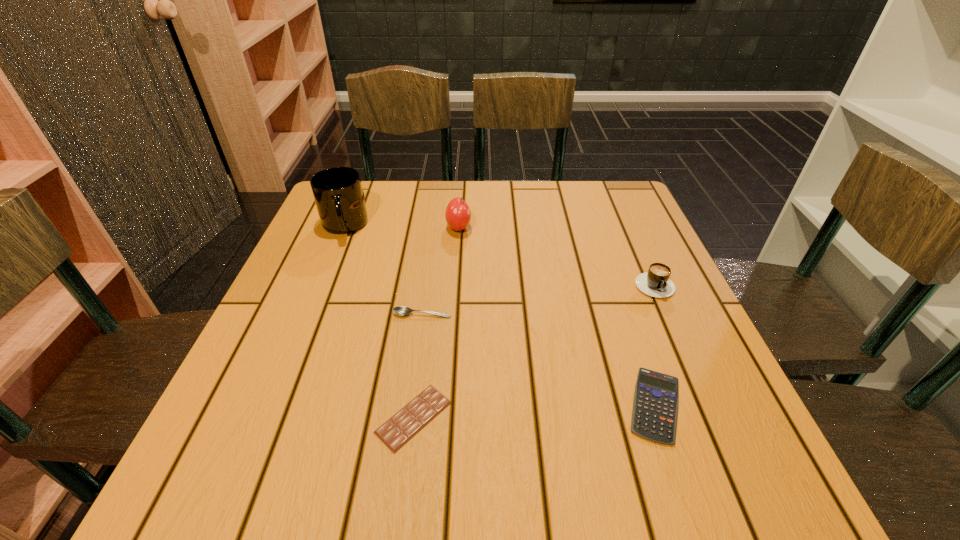
I want to click on free point located 0.290m on the left of the second tallest object, so click(x=331, y=227).

Locate an element on the screen. vacant space situated 0.370m with the handle on the side of the fourth nearest object is located at coordinates (738, 476).

Find the location of a particular element. The image size is (960, 540). free space located 0.240m on the right of the third nearest object is located at coordinates (570, 314).

At what (x,y) coordinates should I click in order to perform the action: click on vacant space located 0.150m on the left of the second shortest object. Please return your answer as a coordinate pair (x, y). The height and width of the screenshot is (540, 960). Looking at the image, I should click on (532, 405).

Find the location of a particular element. This screenshot has width=960, height=540. free region located 0.200m on the back of the shortest object is located at coordinates (428, 303).

Image resolution: width=960 pixels, height=540 pixels. Identify the location of mug located at the far edge. click(338, 194).

You are a GUI agent. You are given a task and a screenshot of the screen. Output one action in this format:
    pyautogui.click(x=<x>, y=<y>)
    Task: Click on the apple at the far edge
    Image resolution: width=960 pixels, height=540 pixels.
    Given the screenshot: What is the action you would take?
    click(x=458, y=215)

The image size is (960, 540). Identify the location of calculator present at the near edge. (655, 406).

Identify the location of chocolate bar at the near edge. Image resolution: width=960 pixels, height=540 pixels. (407, 422).

Where is `object at the left edge`? object at the left edge is located at coordinates (338, 194).